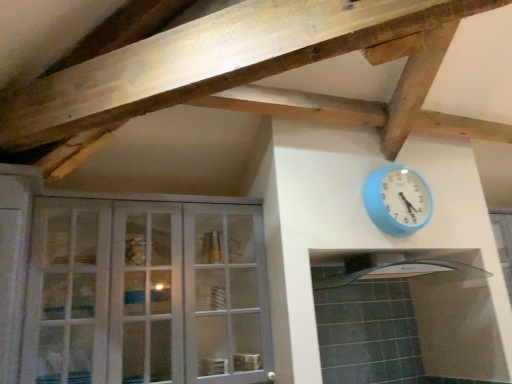
Question: From a real-world perspective, is blue plastic wall clock at upper right under white glass cabinet at left?

Choices:
 (A) yes
 (B) no

Answer: (B)

Question: Is blue plastic wall clock at upper right positioned far away from white glass cabinet at left?

Choices:
 (A) yes
 (B) no

Answer: (B)

Question: Is blue plastic wall clock at upper right wider than white glass cabinet at left?

Choices:
 (A) no
 (B) yes

Answer: (A)

Question: Would you say white glass cabinet at left is part of blue plastic wall clock at upper right's contents?

Choices:
 (A) yes
 (B) no

Answer: (B)

Question: Is blue plastic wall clock at upper right in front of white glass cabinet at left?

Choices:
 (A) no
 (B) yes

Answer: (A)

Question: From a real-world perspective, is white glass cabinet at left physically located above or below blue plastic wall clock at upper right?

Choices:
 (A) above
 (B) below

Answer: (B)

Question: From the image's perspective, is white glass cabinet at left located above or below blue plastic wall clock at upper right?

Choices:
 (A) above
 (B) below

Answer: (B)

Question: Does point (216, 276) appear closer or farther from the camera than point (367, 178)?

Choices:
 (A) farther
 (B) closer

Answer: (B)

Question: Based on their positions, is white glass cabinet at left located to the left or right of blue plastic wall clock at upper right?

Choices:
 (A) right
 (B) left

Answer: (B)

Question: Visually, is clear glass exhaust hood at center positioned to the left or to the right of white glass cabinet at left?

Choices:
 (A) right
 (B) left

Answer: (A)

Question: From a real-world perspective, is clear glass exhaust hood at center physically located above or below white glass cabinet at left?

Choices:
 (A) above
 (B) below

Answer: (A)

Question: Considering their positions, is clear glass exhaust hood at center located in front of or behind white glass cabinet at left?

Choices:
 (A) behind
 (B) front

Answer: (A)

Question: Considering the positions of clear glass exhaust hood at center and white glass cabinet at left in the image, is clear glass exhaust hood at center taller or shorter than white glass cabinet at left?

Choices:
 (A) short
 (B) tall

Answer: (A)

Question: Considering the positions of blue plastic wall clock at upper right and white glass cabinet at left in the image, is blue plastic wall clock at upper right wider or thinner than white glass cabinet at left?

Choices:
 (A) thin
 (B) wide

Answer: (A)

Question: Does point (409, 178) appear closer or farther from the camera than point (126, 241)?

Choices:
 (A) farther
 (B) closer

Answer: (A)